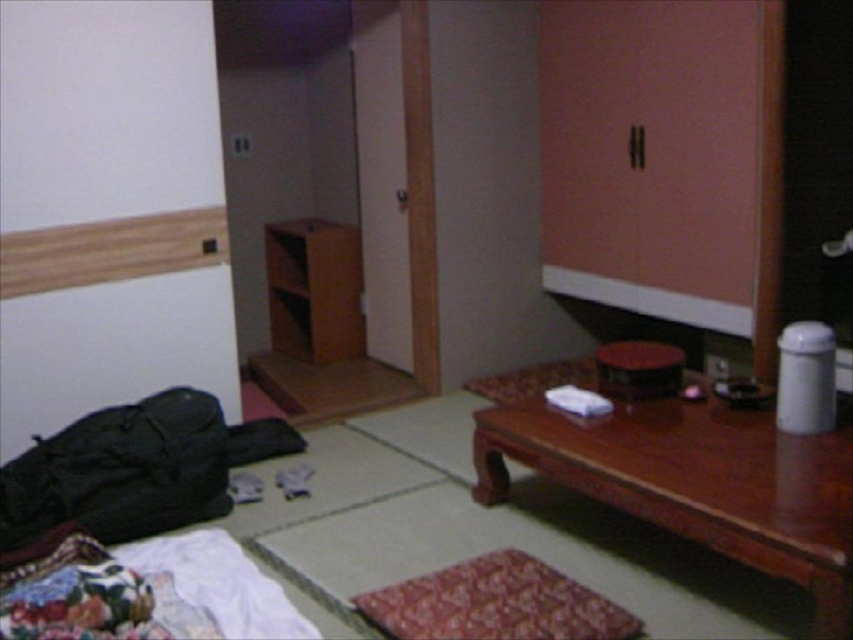
You are organizing a small gathering in the room and need to place a 1.2 meter long rectangular tablecloth. You have the brown wooden table at lower right and the brown wood cabinet at center. Which object can accommodate the tablecloth based on their widths?

The brown wooden table at lower right has a greater width than the brown wood cabinet at center according to the description. Since the tablecloth is 1.2 meters long, the brown wooden table at lower right is the better option as it can accommodate the tablecloth.

You are standing in the room and want to place a small plant on the brown wooden table at lower right. Can you walk directly from your current position at point (695, 483) to the table without moving any objects?

The point (695, 483) is where the brown wooden table at lower right is located, so you are already at the table and can place the plant there without moving anything.